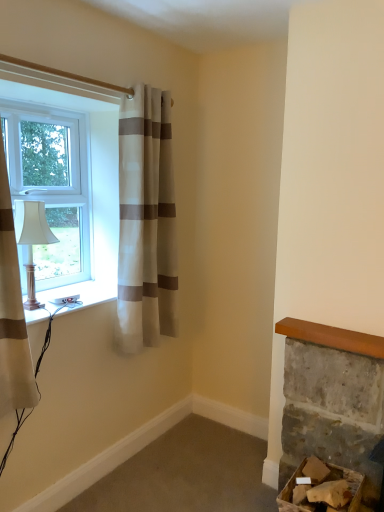
Question: Is white plastic socket at lower left wider than white striped curtain at upper left, marked as the second curtain in a front-to-back arrangement?

Choices:
 (A) no
 (B) yes

Answer: (B)

Question: From a real-world perspective, is white plastic socket at lower left over white striped curtain at upper left, acting as the second curtain starting from the left?

Choices:
 (A) no
 (B) yes

Answer: (A)

Question: Does white plastic socket at lower left have a lesser height compared to white striped curtain at upper left, acting as the second curtain starting from the left?

Choices:
 (A) no
 (B) yes

Answer: (B)

Question: Can you confirm if white plastic socket at lower left is bigger than white striped curtain at upper left, acting as the first curtain starting from the right?

Choices:
 (A) no
 (B) yes

Answer: (A)

Question: From a real-world perspective, is white plastic socket at lower left beneath white striped curtain at upper left, acting as the first curtain starting from the right?

Choices:
 (A) yes
 (B) no

Answer: (A)

Question: Is the position of white plastic socket at lower left more distant than that of white striped curtain at upper left, acting as the first curtain starting from the right?

Choices:
 (A) yes
 (B) no

Answer: (B)

Question: Does white striped curtain at upper left, acting as the second curtain starting from the left, appear on the right side of white striped curtain at left, the 2th curtain viewed from the right?

Choices:
 (A) yes
 (B) no

Answer: (A)

Question: Is white striped curtain at upper left, the first curtain viewed from the back, wider than white striped curtain at left, which is the first curtain from left to right?

Choices:
 (A) no
 (B) yes

Answer: (A)

Question: Is white striped curtain at upper left, acting as the second curtain starting from the left, at the left side of white striped curtain at left, the 2th curtain viewed from the right?

Choices:
 (A) no
 (B) yes

Answer: (A)

Question: Is white striped curtain at upper left, acting as the first curtain starting from the right, far from white striped curtain at left, which is the first curtain from left to right?

Choices:
 (A) yes
 (B) no

Answer: (B)

Question: Is white striped curtain at upper left, acting as the first curtain starting from the right, in front of white striped curtain at left, which appears as the second curtain when viewed from the back?

Choices:
 (A) yes
 (B) no

Answer: (B)

Question: Can you confirm if white striped curtain at upper left, the first curtain viewed from the back, is shorter than white striped curtain at left, which is the first curtain from left to right?

Choices:
 (A) no
 (B) yes

Answer: (B)

Question: Does cardboard box at lower right have a smaller size compared to matte white lamp at left?

Choices:
 (A) yes
 (B) no

Answer: (B)